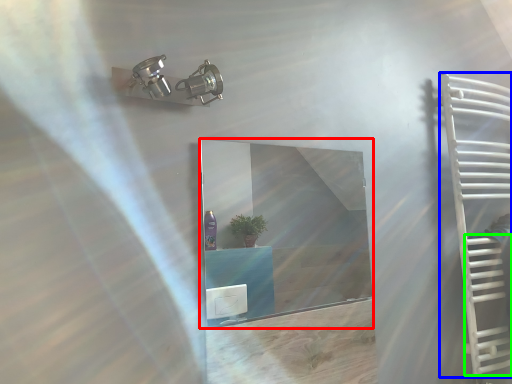
Question: Which object is positioned closest to mirror (highlighted by a red box)? Select from ladder (highlighted by a blue box) and stairs (highlighted by a green box).

Choices:
 (A) ladder
 (B) stairs

Answer: (A)